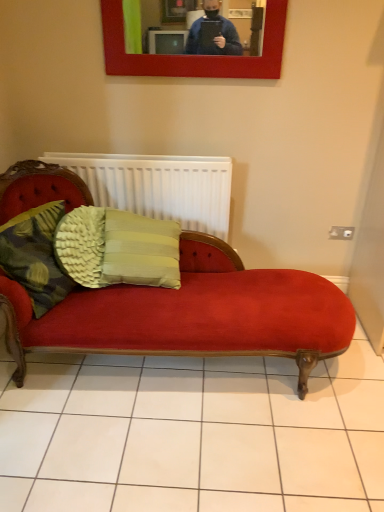
The image size is (384, 512). Describe the element at coordinates (35, 256) in the screenshot. I see `woven fabric cushion at left, positioned as the second pillow in right-to-left order` at that location.

What is the approximate width of woven fabric cushion at left, placed as the first pillow when sorted from left to right?

The width of woven fabric cushion at left, placed as the first pillow when sorted from left to right, is 8.81 inches.

Identify the location of white matte radiator at center. (158, 186).

The height and width of the screenshot is (512, 384). I want to click on woven fabric cushion at left, placed as the first pillow when sorted from left to right, so click(x=35, y=256).

You are a GUI agent. You are given a task and a screenshot of the screen. Output one action in this format:
    pyautogui.click(x=<x>, y=<y>)
    Task: Click on the pillow beneath the woven fabric cushion at left, positioned as the second pillow in right-to-left order (from a real-world perspective)
    
    Given the screenshot: What is the action you would take?
    pyautogui.click(x=117, y=248)

Is the position of woven fabric cushion at left, placed as the first pillow when sorted from left to right, more distant than that of green textured cushion at center, positioned as the 1th pillow in right-to-left order?

No, woven fabric cushion at left, placed as the first pillow when sorted from left to right, is in front of green textured cushion at center, positioned as the 1th pillow in right-to-left order.

Is woven fabric cushion at left, positioned as the second pillow in right-to-left order, at the right side of green textured cushion at center, positioned as the 1th pillow in right-to-left order?

No.

From the image's perspective, which is below, woven fabric cushion at left, placed as the first pillow when sorted from left to right, or green textured cushion at center, the second pillow when ordered from left to right?

From the image's view, woven fabric cushion at left, placed as the first pillow when sorted from left to right, is below.

In terms of size, does woven fabric cushion at left, positioned as the second pillow in right-to-left order, appear bigger or smaller than white matte radiator at center?

Clearly, woven fabric cushion at left, positioned as the second pillow in right-to-left order, is smaller in size than white matte radiator at center.

From a real-world perspective, between woven fabric cushion at left, positioned as the second pillow in right-to-left order, and white matte radiator at center, who is vertically higher?

white matte radiator at center is physically above.

In order to click on the 2nd pillow in front of the white matte radiator at center, starting your count from the anchor in this screenshot , I will do `click(35, 256)`.

Which is in front, woven fabric cushion at left, placed as the first pillow when sorted from left to right, or white matte radiator at center?

woven fabric cushion at left, placed as the first pillow when sorted from left to right, is more forward.

Is white matte radiator at center completely or partially outside of woven fabric cushion at left, positioned as the second pillow in right-to-left order?

white matte radiator at center is positioned outside woven fabric cushion at left, positioned as the second pillow in right-to-left order.

Is white matte radiator at center not close to woven fabric cushion at left, positioned as the second pillow in right-to-left order?

Actually, white matte radiator at center and woven fabric cushion at left, positioned as the second pillow in right-to-left order, are a little close together.

Is white matte radiator at center wider or thinner than woven fabric cushion at left, placed as the first pillow when sorted from left to right?

Considering their sizes, white matte radiator at center looks slimmer than woven fabric cushion at left, placed as the first pillow when sorted from left to right.

Does white matte radiator at center appear on the left side of woven fabric cushion at left, placed as the first pillow when sorted from left to right?

In fact, white matte radiator at center is to the right of woven fabric cushion at left, placed as the first pillow when sorted from left to right.

Does green textured cushion at center, positioned as the 1th pillow in right-to-left order, turn towards white matte radiator at center?

No, green textured cushion at center, positioned as the 1th pillow in right-to-left order, is not turned towards white matte radiator at center.

In terms of width, does green textured cushion at center, the second pillow when ordered from left to right, look wider or thinner when compared to white matte radiator at center?

Considering their sizes, green textured cushion at center, the second pillow when ordered from left to right, looks broader than white matte radiator at center.

From the picture: Looking at the image, does green textured cushion at center, positioned as the 1th pillow in right-to-left order, seem bigger or smaller compared to white matte radiator at center?

In the image, green textured cushion at center, positioned as the 1th pillow in right-to-left order, appears to be larger than white matte radiator at center.

Does green textured cushion at center, positioned as the 1th pillow in right-to-left order, appear on the left side of white matte radiator at center?

In fact, green textured cushion at center, positioned as the 1th pillow in right-to-left order, is to the right of white matte radiator at center.

Is woven fabric cushion at left, positioned as the second pillow in right-to-left order, completely or partially inside green textured cushion at center, the second pillow when ordered from left to right?

No, green textured cushion at center, the second pillow when ordered from left to right, does not contain woven fabric cushion at left, positioned as the second pillow in right-to-left order.

Is green textured cushion at center, positioned as the 1th pillow in right-to-left order, next to woven fabric cushion at left, placed as the first pillow when sorted from left to right?

green textured cushion at center, positioned as the 1th pillow in right-to-left order, and woven fabric cushion at left, placed as the first pillow when sorted from left to right, are clearly separated.

At what (x,y) coordinates should I click in order to perform the action: click on pillow on the left of green textured cushion at center, the second pillow when ordered from left to right. Please return your answer as a coordinate pair (x, y). The image size is (384, 512). Looking at the image, I should click on (35, 256).

Which point is more distant from viewer, (92, 260) or (23, 263)?

The point (92, 260) is behind.

Is white matte radiator at center not close to green textured cushion at center, the second pillow when ordered from left to right?

No, there isn't a large distance between white matte radiator at center and green textured cushion at center, the second pillow when ordered from left to right.

Can you confirm if white matte radiator at center is bigger than green textured cushion at center, the second pillow when ordered from left to right?

No, white matte radiator at center is not bigger than green textured cushion at center, the second pillow when ordered from left to right.

Measure the distance between white matte radiator at center and green textured cushion at center, the second pillow when ordered from left to right.

white matte radiator at center is 13.66 inches from green textured cushion at center, the second pillow when ordered from left to right.

Considering the relative sizes of white matte radiator at center and green textured cushion at center, the second pillow when ordered from left to right, in the image provided, is white matte radiator at center wider than green textured cushion at center, the second pillow when ordered from left to right,?

No, white matte radiator at center is not wider than green textured cushion at center, the second pillow when ordered from left to right.

Where is `pillow that appears on the left of green textured cushion at center, the second pillow when ordered from left to right`? This screenshot has height=512, width=384. pillow that appears on the left of green textured cushion at center, the second pillow when ordered from left to right is located at coordinates (35, 256).

You are a GUI agent. You are given a task and a screenshot of the screen. Output one action in this format:
    pyautogui.click(x=<x>, y=<y>)
    Task: Click on the pillow that is the 1st one below the white matte radiator at center (from a real-world perspective)
    This screenshot has width=384, height=512.
    Given the screenshot: What is the action you would take?
    pyautogui.click(x=35, y=256)

Looking at the image, which one is located further to white matte radiator at center, woven fabric cushion at left, positioned as the second pillow in right-to-left order, or green textured cushion at center, the second pillow when ordered from left to right?

woven fabric cushion at left, positioned as the second pillow in right-to-left order.

In the scene shown: From the image, which object appears to be farther from woven fabric cushion at left, positioned as the second pillow in right-to-left order, green textured cushion at center, positioned as the 1th pillow in right-to-left order, or white matte radiator at center?

white matte radiator at center.

Estimate the real-world distances between objects in this image. Which object is further from woven fabric cushion at left, positioned as the second pillow in right-to-left order, white matte radiator at center or green textured cushion at center, positioned as the 1th pillow in right-to-left order?

white matte radiator at center.

From the image, which object appears to be nearer to green textured cushion at center, positioned as the 1th pillow in right-to-left order, white matte radiator at center or woven fabric cushion at left, positioned as the second pillow in right-to-left order?

woven fabric cushion at left, positioned as the second pillow in right-to-left order.

When comparing their distances from white matte radiator at center, does green textured cushion at center, the second pillow when ordered from left to right, or woven fabric cushion at left, placed as the first pillow when sorted from left to right, seem closer?

green textured cushion at center, the second pillow when ordered from left to right, lies closer to white matte radiator at center than the other object.

When comparing their distances from green textured cushion at center, the second pillow when ordered from left to right, does woven fabric cushion at left, positioned as the second pillow in right-to-left order, or white matte radiator at center seem further?

white matte radiator at center is further to green textured cushion at center, the second pillow when ordered from left to right.

The width and height of the screenshot is (384, 512). Find the location of `pillow between woven fabric cushion at left, placed as the first pillow when sorted from left to right, and white matte radiator at center from front to back`. pillow between woven fabric cushion at left, placed as the first pillow when sorted from left to right, and white matte radiator at center from front to back is located at coordinates (117, 248).